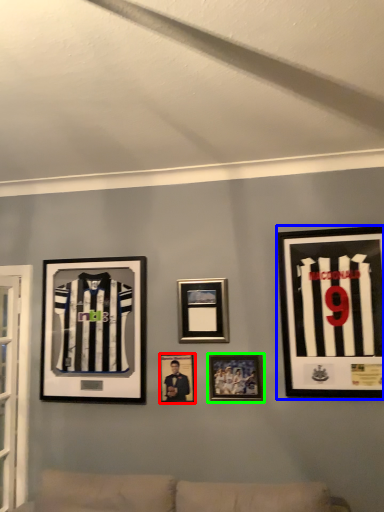
Question: Which object is positioned farthest from picture frame (highlighted by a red box)? Select from picture frame (highlighted by a blue box) and picture frame (highlighted by a green box).

Choices:
 (A) picture frame
 (B) picture frame

Answer: (A)